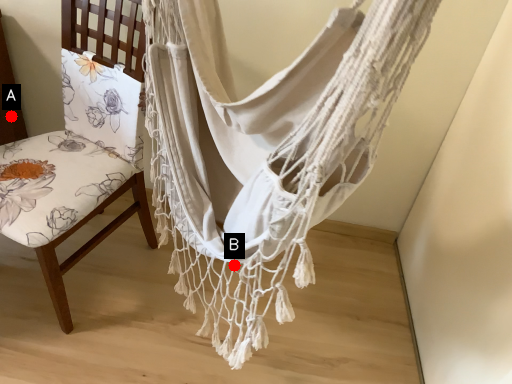
Question: Two points are circled on the image, labeled by A and B beside each circle. Which of the following is the farthest from the observer?

Choices:
 (A) A is further
 (B) B is further

Answer: (A)